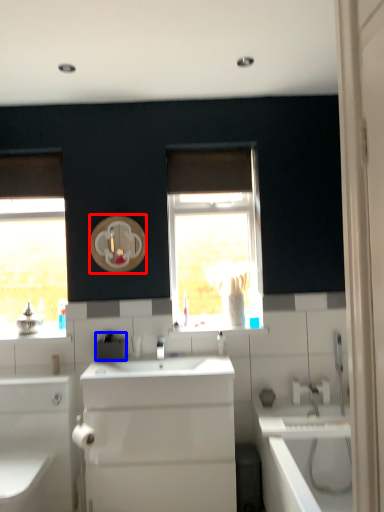
Question: Which point is closer to the camera, mirror (highlighted by a red box) or appliance (highlighted by a blue box)?

Choices:
 (A) mirror
 (B) appliance

Answer: (B)